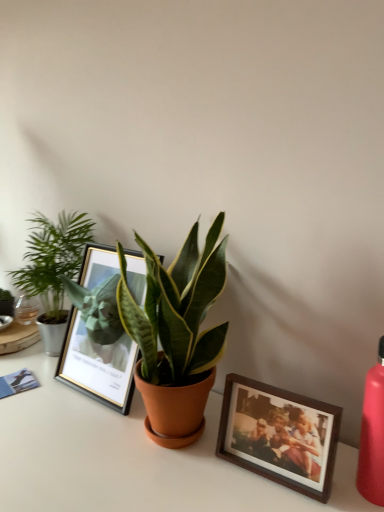
Question: Can you confirm if metallic gold picture frame at center, which is the 2th picture frame in front-to-back order, is bigger than matte red bottle at right?

Choices:
 (A) yes
 (B) no

Answer: (A)

Question: Does metallic gold picture frame at center, which is the 2th picture frame in front-to-back order, appear on the right side of matte red bottle at right?

Choices:
 (A) yes
 (B) no

Answer: (B)

Question: Is metallic gold picture frame at center, positioned as the first picture frame in left-to-right order, far away from matte red bottle at right?

Choices:
 (A) yes
 (B) no

Answer: (B)

Question: Is metallic gold picture frame at center, positioned as the first picture frame in left-to-right order, looking in the opposite direction of matte red bottle at right?

Choices:
 (A) no
 (B) yes

Answer: (A)

Question: Is metallic gold picture frame at center, which is the 2th picture frame in right-to-left order, facing towards matte red bottle at right?

Choices:
 (A) no
 (B) yes

Answer: (A)

Question: From a real-world perspective, is metallic gold picture frame at center, positioned as the first picture frame in left-to-right order, below matte red bottle at right?

Choices:
 (A) yes
 (B) no

Answer: (B)

Question: Can you confirm if green glossy houseplant at center, which is the 1th houseplant from front to back, is bigger than metallic gold picture frame at center, positioned as the 1th picture frame in back-to-front order?

Choices:
 (A) yes
 (B) no

Answer: (A)

Question: From the image's perspective, is green glossy houseplant at center, which is the 1th houseplant from front to back, located beneath metallic gold picture frame at center, which is the 2th picture frame in right-to-left order?

Choices:
 (A) no
 (B) yes

Answer: (A)

Question: Is green glossy houseplant at center, which ranks as the second houseplant in left-to-right order, shorter than metallic gold picture frame at center, which is the 2th picture frame in right-to-left order?

Choices:
 (A) yes
 (B) no

Answer: (B)

Question: Would you say green glossy houseplant at center, which appears as the 2th houseplant when viewed from the back, is outside metallic gold picture frame at center, which is the 2th picture frame in right-to-left order?

Choices:
 (A) yes
 (B) no

Answer: (A)

Question: Could you tell me if green glossy houseplant at center, which ranks as the second houseplant in left-to-right order, is turned towards metallic gold picture frame at center, positioned as the first picture frame in left-to-right order?

Choices:
 (A) yes
 (B) no

Answer: (B)

Question: Is green glossy houseplant at center, which is the 1th houseplant from front to back, looking in the opposite direction of metallic gold picture frame at center, which is the 2th picture frame in right-to-left order?

Choices:
 (A) yes
 (B) no

Answer: (B)

Question: From the image's perspective, does wooden photo frame at lower right, the first picture frame viewed from the right, appear lower than green glossy houseplant at center, which appears as the 2th houseplant when viewed from the back?

Choices:
 (A) no
 (B) yes

Answer: (B)